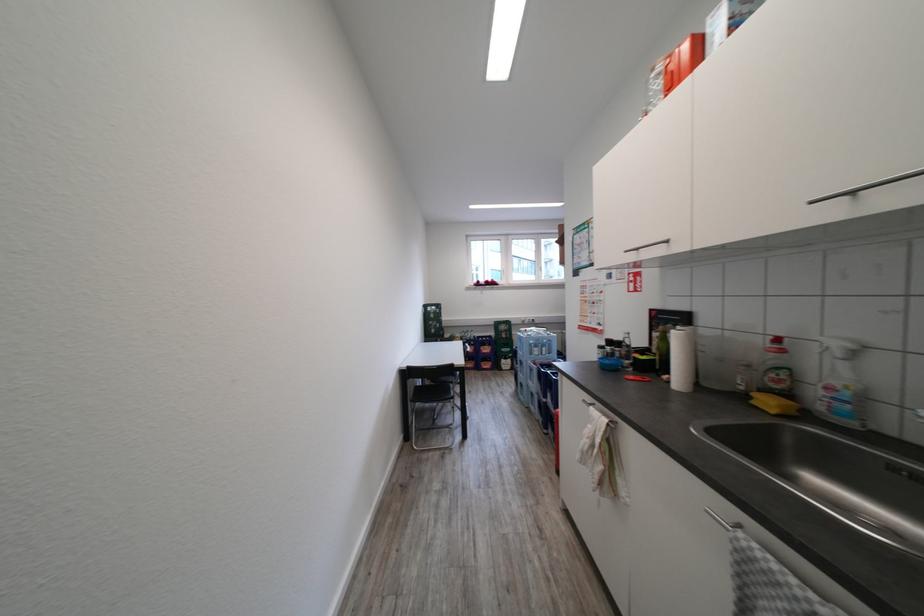
Identify the location of small blue bowl. (610, 363).